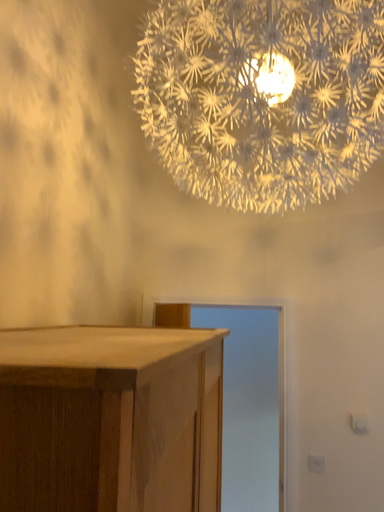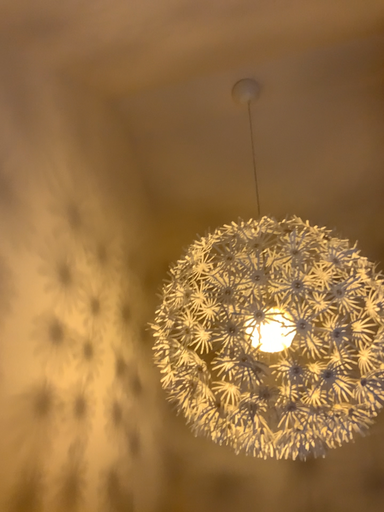
Question: Which way did the camera rotate in the video?

Choices:
 (A) rotated downward
 (B) rotated upward

Answer: (B)